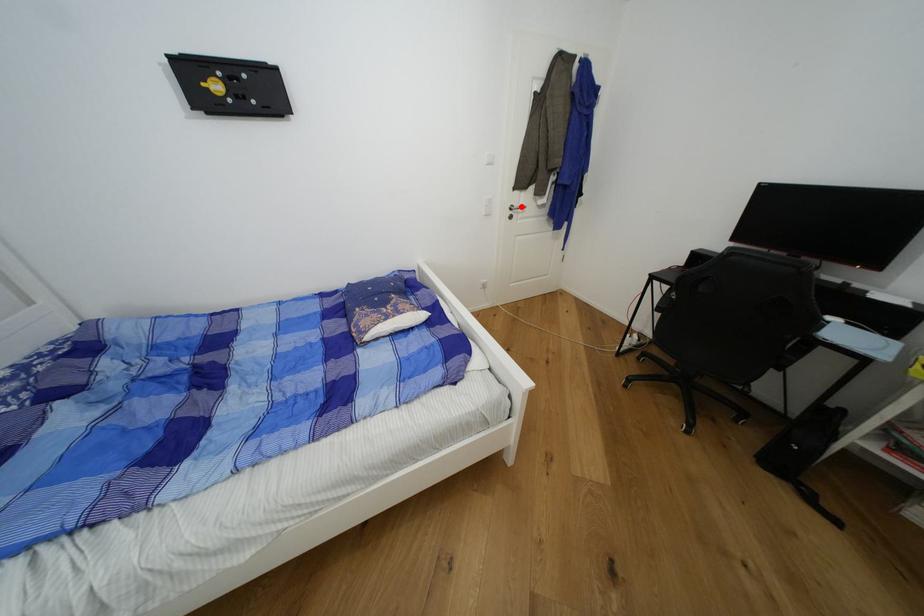
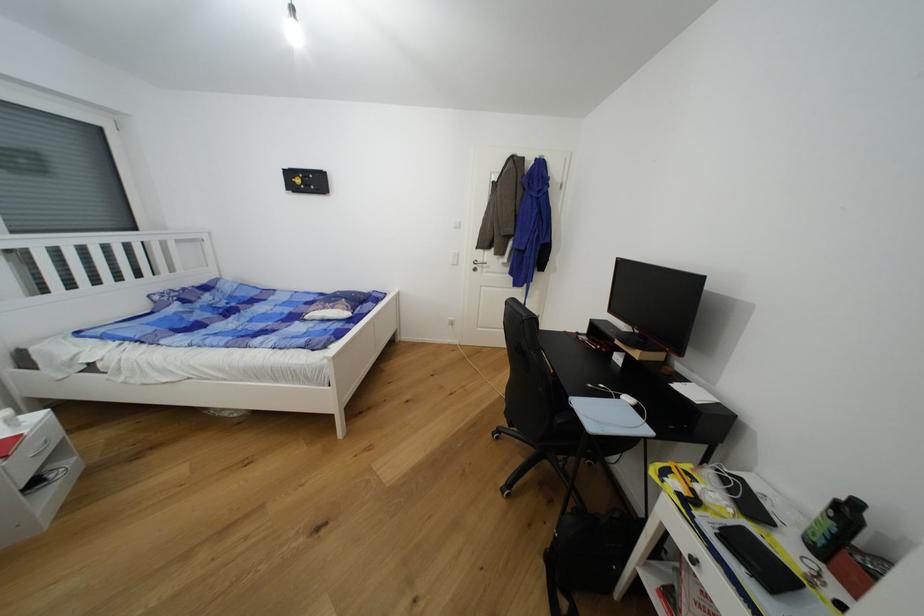
In the second image, find the point that corresponds to the highlighted location in the first image.

(484, 262)